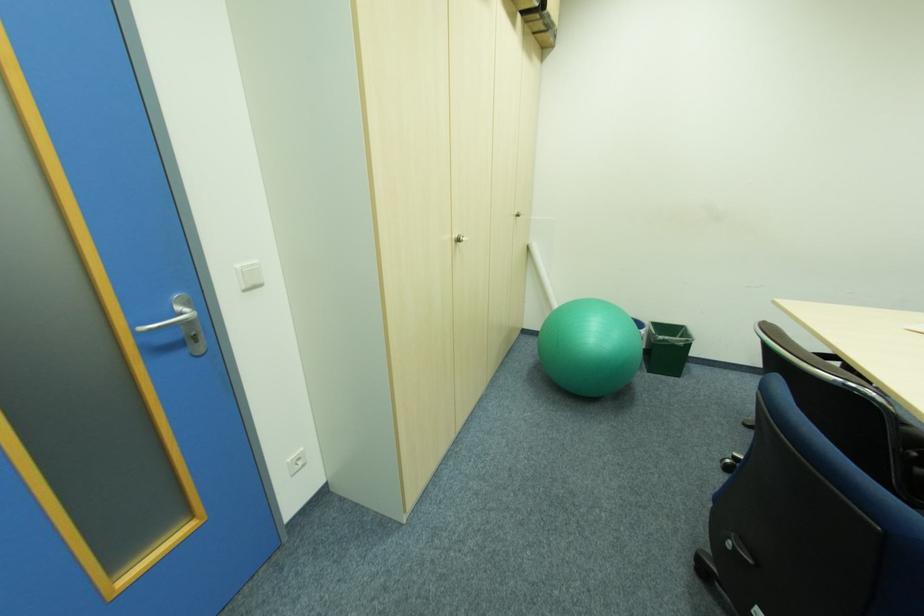
Find where to push the white light switch. Please return your answer as a coordinate pair (x, y).

(296, 462)